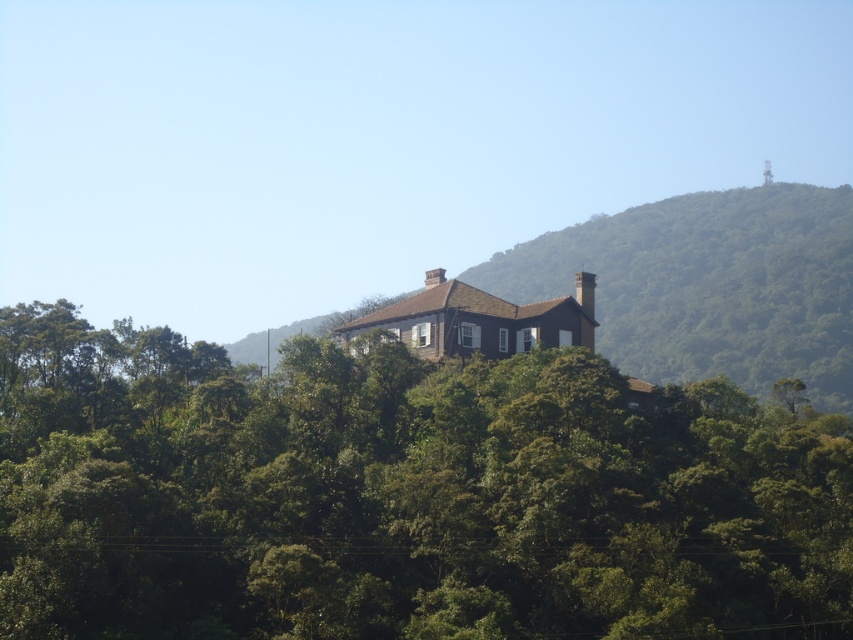
Question: Does green leafy tree at center have a lesser width compared to brown stone house at center?

Choices:
 (A) yes
 (B) no

Answer: (A)

Question: Which point appears farthest from the camera in this image?

Choices:
 (A) (672, 332)
 (B) (181, 468)

Answer: (A)

Question: Is green leafy tree at center wider than brown stone house at center?

Choices:
 (A) yes
 (B) no

Answer: (B)

Question: Can you confirm if green leafy tree at center is positioned to the left of brown stone house at center?

Choices:
 (A) no
 (B) yes

Answer: (B)